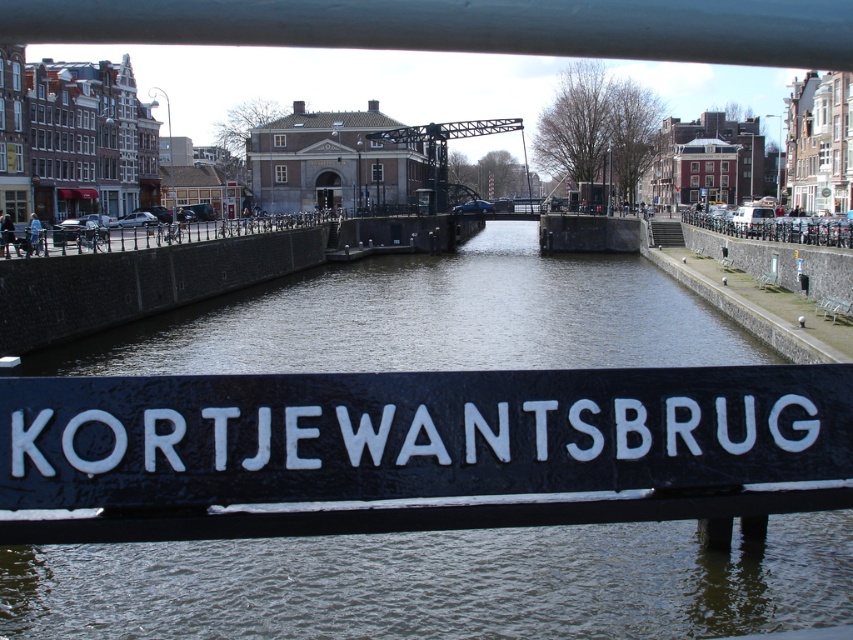
Question: Which point is farther from the camera taking this photo?

Choices:
 (A) (844, 580)
 (B) (640, 442)

Answer: (A)

Question: Is black water at center to the left of black painted wood sign at center from the viewer's perspective?

Choices:
 (A) yes
 (B) no

Answer: (B)

Question: Among these points, which one is nearest to the camera?

Choices:
 (A) (403, 540)
 (B) (466, 484)

Answer: (B)

Question: Can you confirm if black water at center is positioned above black painted wood sign at center?

Choices:
 (A) yes
 (B) no

Answer: (A)

Question: Can you confirm if black water at center is smaller than black painted wood sign at center?

Choices:
 (A) no
 (B) yes

Answer: (A)

Question: Among these objects, which one is nearest to the camera?

Choices:
 (A) black painted wood sign at center
 (B) black water at center

Answer: (A)